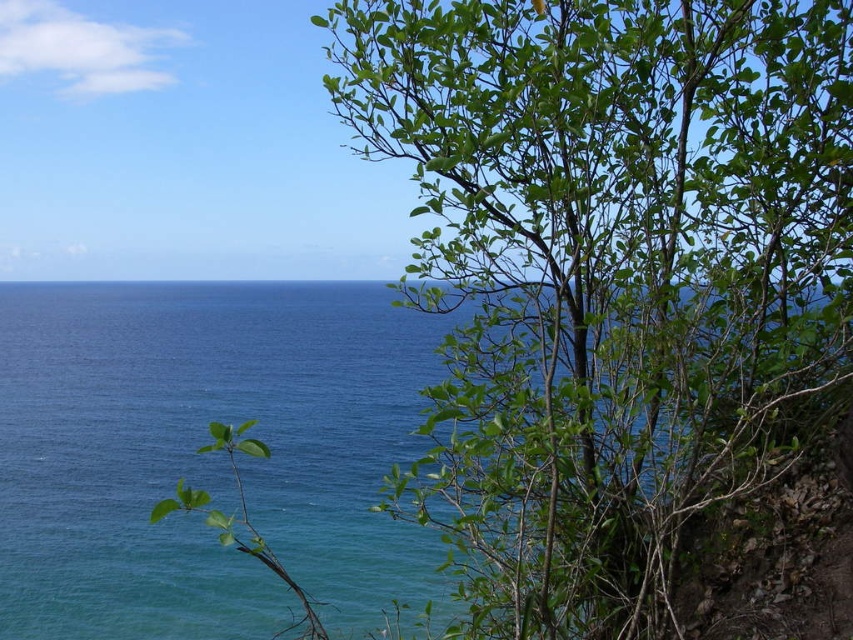
Question: Is green leafy bush at right to the right of blue water at center from the viewer's perspective?

Choices:
 (A) no
 (B) yes

Answer: (B)

Question: Observing the image, what is the correct spatial positioning of green leafy bush at right in reference to blue water at center?

Choices:
 (A) right
 (B) left

Answer: (A)

Question: Among these points, which one is nearest to the camera?

Choices:
 (A) (22, 486)
 (B) (422, 515)

Answer: (B)

Question: Which point is farther to the camera?

Choices:
 (A) (663, 515)
 (B) (189, 616)

Answer: (B)

Question: Is green leafy bush at right to the right of blue water at center from the viewer's perspective?

Choices:
 (A) no
 (B) yes

Answer: (B)